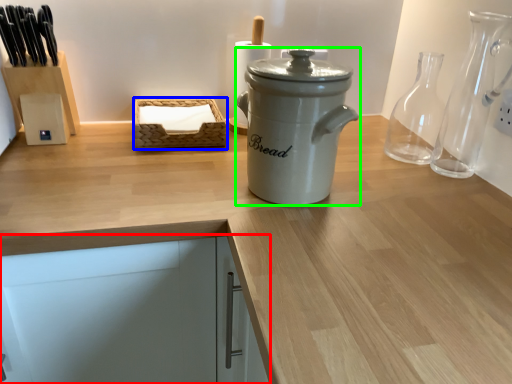
Question: Based on their relative distances, which object is nearer to cabinetry (highlighted by a red box)? Choose from basket (highlighted by a blue box) and kitchen appliance (highlighted by a green box).

Choices:
 (A) basket
 (B) kitchen appliance

Answer: (B)